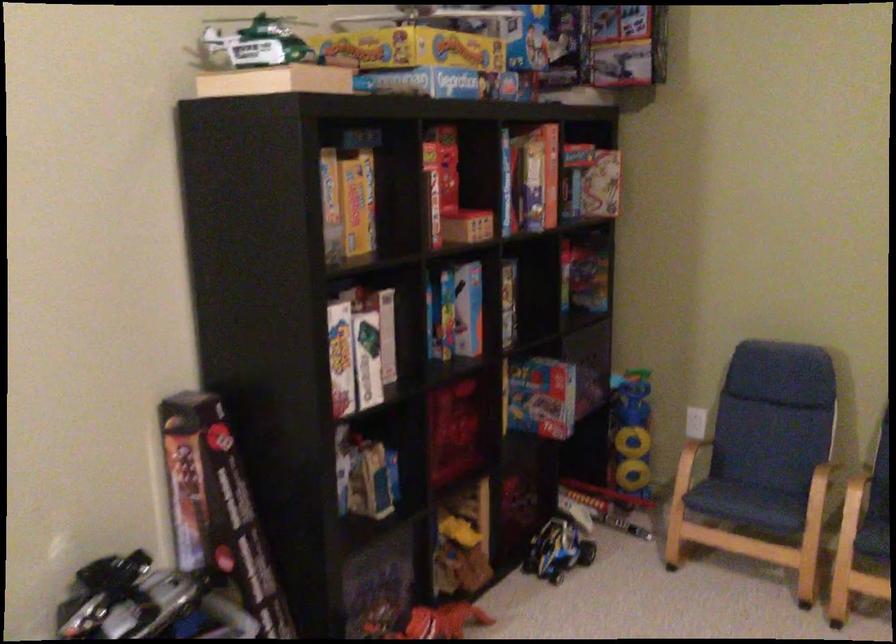
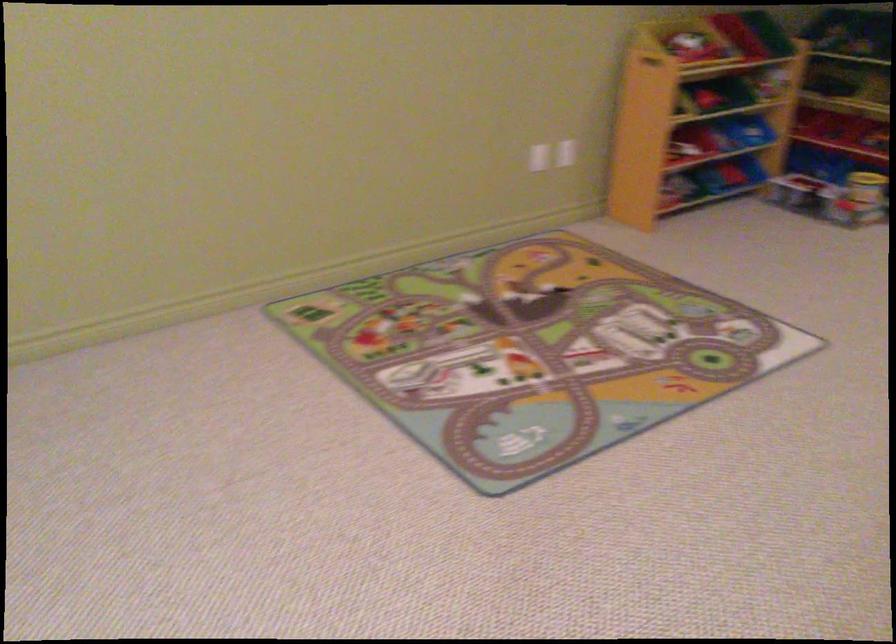
In the scene shown: Based on the continuous images, in which direction is the camera rotating?

The rotation direction of the camera is right-down.